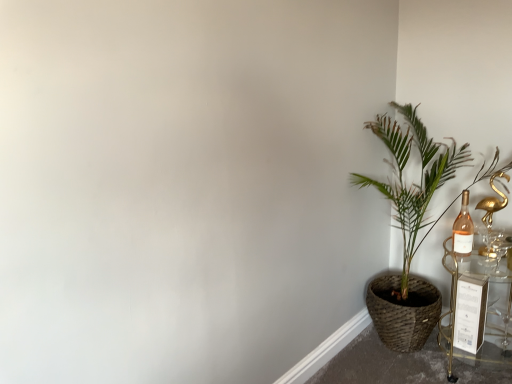
Question: Relative to pink glass bottle at right, is green woven basket at right in front or behind?

Choices:
 (A) behind
 (B) front

Answer: (B)

Question: From a real-world perspective, is green woven basket at right physically located above or below pink glass bottle at right?

Choices:
 (A) below
 (B) above

Answer: (A)

Question: Which object is the closest to the green woven basket at right?

Choices:
 (A) gold metallic swan at right
 (B) pink glass bottle at right
 (C) gold metallic table at right

Answer: (C)

Question: Based on their relative distances, which object is nearer to the pink glass bottle at right?

Choices:
 (A) gold metallic table at right
 (B) gold metallic swan at right
 (C) green woven basket at right

Answer: (B)